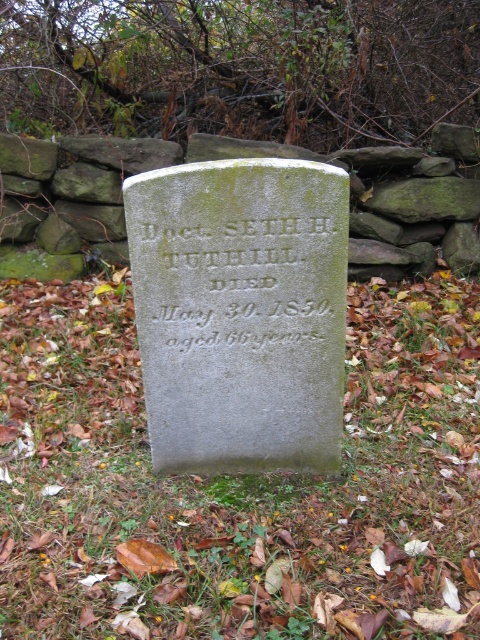
Is green mossy stone at center thinner than green stone inscription at center?

In fact, green mossy stone at center might be wider than green stone inscription at center.

The image size is (480, 640). In order to click on green mossy stone at center in this screenshot , I will do `click(233, 480)`.

This screenshot has height=640, width=480. I want to click on green mossy stone at center, so click(x=233, y=480).